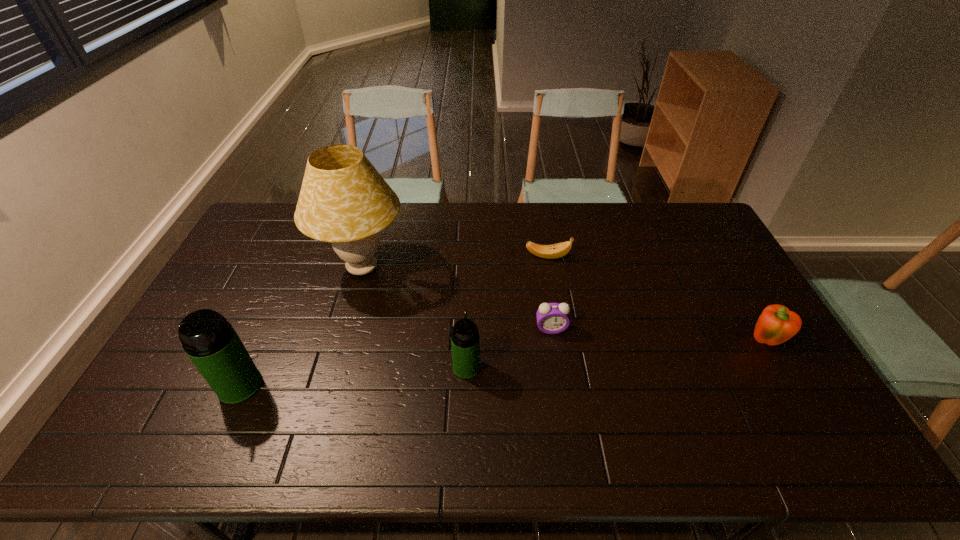
This screenshot has width=960, height=540. I want to click on free space for a new thermos bottle on the right, so click(678, 350).